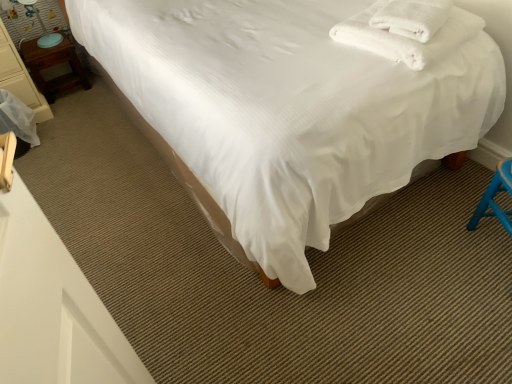
Question: Does wooden nightstand at left come in front of matte blue table lamp at left?

Choices:
 (A) yes
 (B) no

Answer: (B)

Question: Is wooden nightstand at left aimed at matte blue table lamp at left?

Choices:
 (A) no
 (B) yes

Answer: (A)

Question: Is wooden nightstand at left positioned with its back to matte blue table lamp at left?

Choices:
 (A) no
 (B) yes

Answer: (A)

Question: Does wooden nightstand at left have a greater width compared to matte blue table lamp at left?

Choices:
 (A) no
 (B) yes

Answer: (B)

Question: Does wooden nightstand at left lie behind matte blue table lamp at left?

Choices:
 (A) yes
 (B) no

Answer: (A)

Question: Is wooden nightstand at left not close to matte blue table lamp at left?

Choices:
 (A) no
 (B) yes

Answer: (A)

Question: Would you say wooden nightstand at left is a long distance from matte blue table lamp at left?

Choices:
 (A) no
 (B) yes

Answer: (A)

Question: Is wooden nightstand at left beside matte blue table lamp at left?

Choices:
 (A) no
 (B) yes

Answer: (A)

Question: Considering the relative sizes of wooden nightstand at left and matte blue table lamp at left in the image provided, is wooden nightstand at left bigger than matte blue table lamp at left?

Choices:
 (A) no
 (B) yes

Answer: (B)

Question: Is wooden nightstand at left behind matte blue table lamp at left?

Choices:
 (A) yes
 (B) no

Answer: (B)

Question: Is wooden nightstand at left taller than matte blue table lamp at left?

Choices:
 (A) no
 (B) yes

Answer: (B)

Question: Is wooden nightstand at left at the right side of matte blue table lamp at left?

Choices:
 (A) no
 (B) yes

Answer: (A)

Question: From a real-world perspective, is wooden nightstand at left physically below white soft towel at upper right?

Choices:
 (A) yes
 (B) no

Answer: (A)